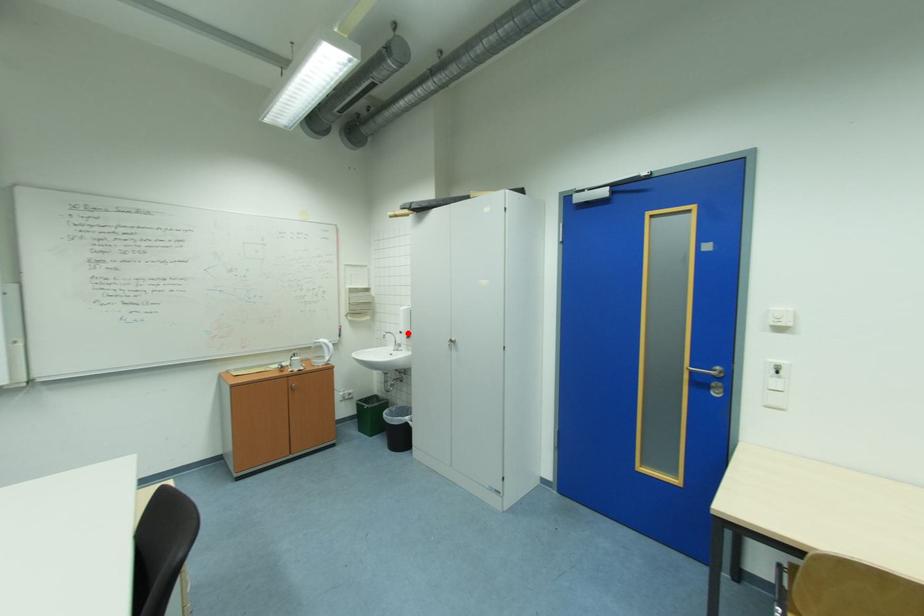
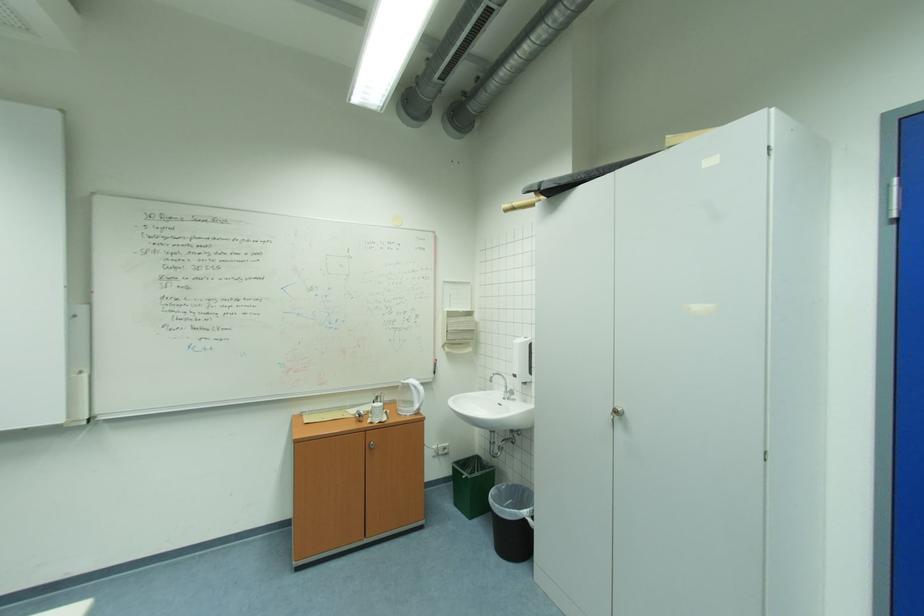
Question: I am providing you with two images of the same scene from different viewpoints. A red point is shown in image1. For the corresponding object point in image2, is it positioned nearer or farther from the camera?

Choices:
 (A) Nearer
 (B) Farther

Answer: (B)